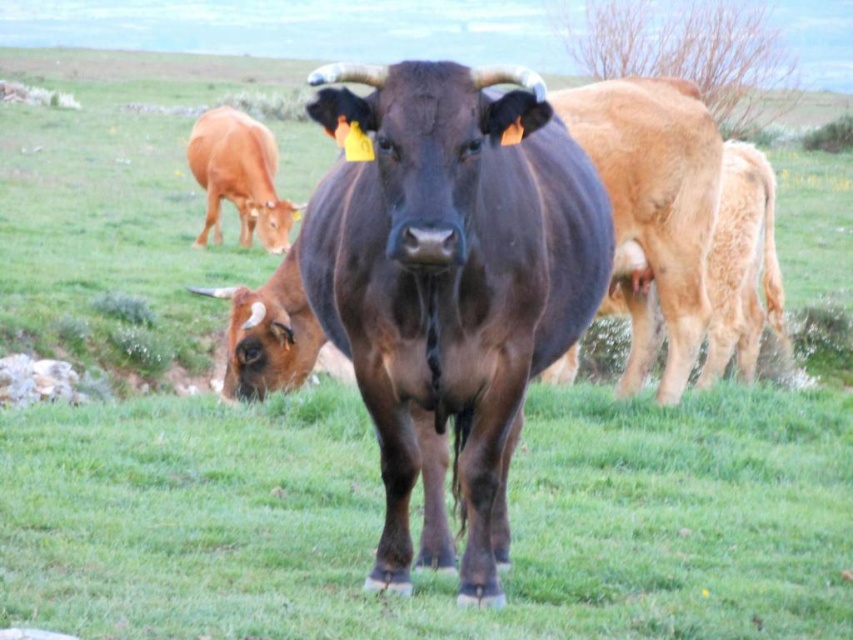
Consider the image. You are a farmer checking the field. You see the shiny brown bull at center and the brown glossy cow at left. Which animal would cast a larger shadow on the ground?

The shiny brown bull at center is bigger than the brown glossy cow at left, so it would cast a larger shadow on the ground.

In the image of the cows grazing in the field, there is a point at coordinates (268, 333). Which cow does this point correspond to?

The point at coordinates (268, 333) marks the brown glossy cow at lower left.